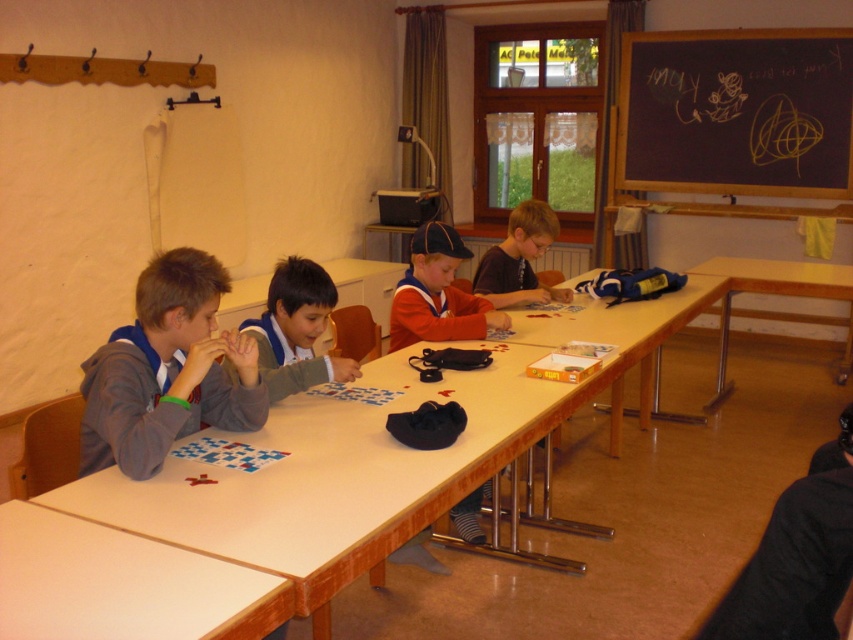
Does orange fabric shirt at center have a lesser width compared to wooden table at right?

Correct, orange fabric shirt at center's width is less than wooden table at right's.

Between point (485, 304) and point (782, 316), which one is positioned in front?

Positioned in front is point (485, 304).

Between point (433, 292) and point (795, 316), which one is positioned in front?

Point (433, 292) is more forward.

Find the location of a particular element. orange fabric shirt at center is located at coordinates (438, 292).

Does black chalkboard at upper right come behind blue uniform shirt at center?

That is True.

Is black chalkboard at upper right thinner than blue uniform shirt at center?

Incorrect, black chalkboard at upper right's width is not less than blue uniform shirt at center's.

Is point (793, 113) closer to camera compared to point (270, 326)?

No.

This screenshot has width=853, height=640. Identify the location of black chalkboard at upper right. (735, 113).

Which is more to the right, white wood table at center or white matte table at lower left?

Positioned to the right is white wood table at center.

Between white wood table at center and white matte table at lower left, which one is positioned lower?

white matte table at lower left is below.

Measure the distance between point (299, 579) and camera.

They are 1.43 meters apart.

At what (x,y) coordinates should I click in order to perform the action: click on white wood table at center. Please return your answer as a coordinate pair (x, y). The height and width of the screenshot is (640, 853). Looking at the image, I should click on (381, 456).